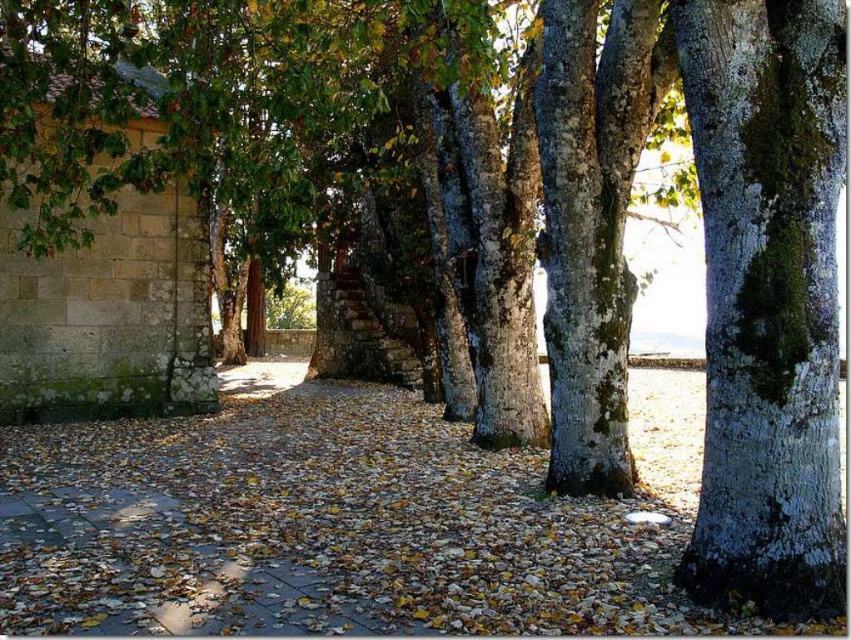
You are standing on the stone wall with green moss on the left and want to walk to the point marked at coordinate (340, 524). Which direction should you head to reach the point on the brown stone pavement at center?

You should head towards the center because the point marked at coordinate (340, 524) is located on the brown stone pavement at center.

You are standing on the brown stone pavement at center and want to reach the green mossy bark tree at right. Which direction should you move to get closer to the tree?

Since the brown stone pavement at center is closer to the viewer than the green mossy bark tree at right, you should move forward towards the tree to get closer to it.